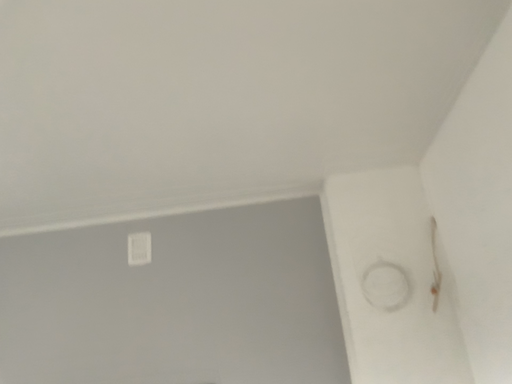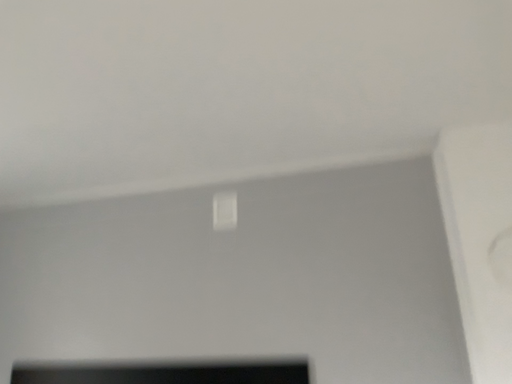
Question: How did the camera likely rotate when shooting the video?

Choices:
 (A) rotated right
 (B) rotated left

Answer: (B)